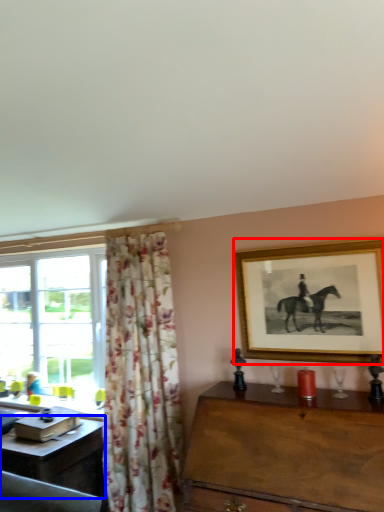
Question: Which object appears farthest to the camera in this image, picture frame (highlighted by a red box) or desk (highlighted by a blue box)?

Choices:
 (A) picture frame
 (B) desk

Answer: (B)